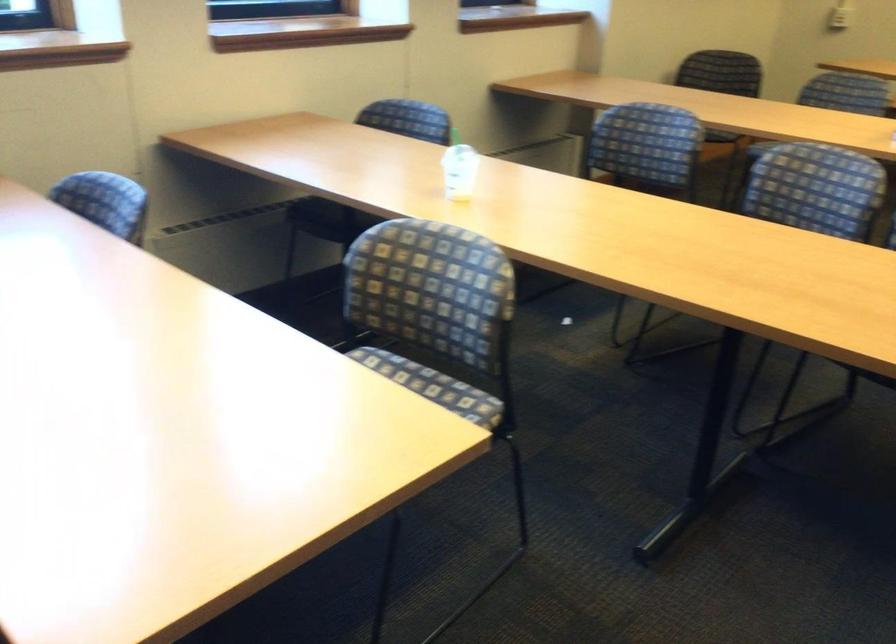
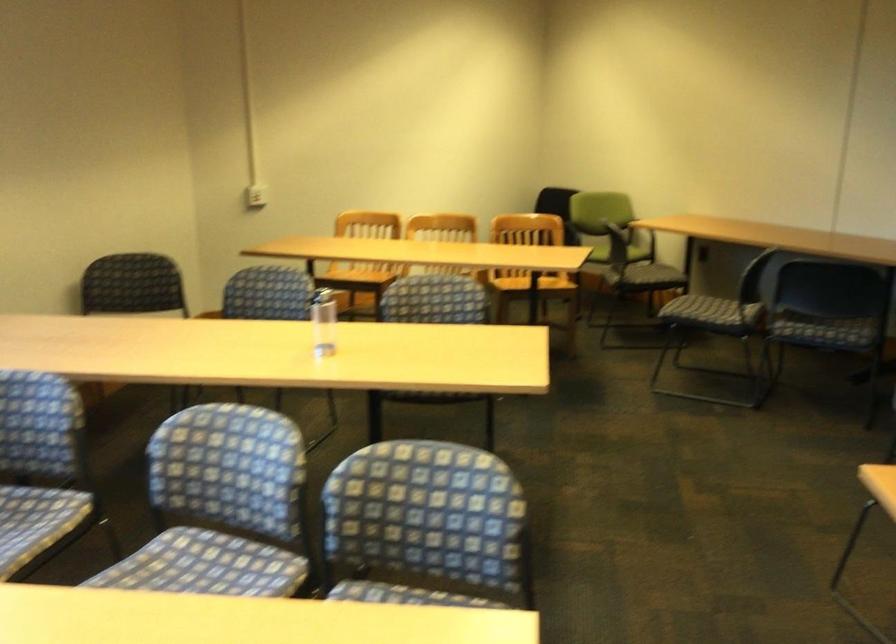
In the second image, find the point that corresponds to (795,211) in the first image.

(221, 506)